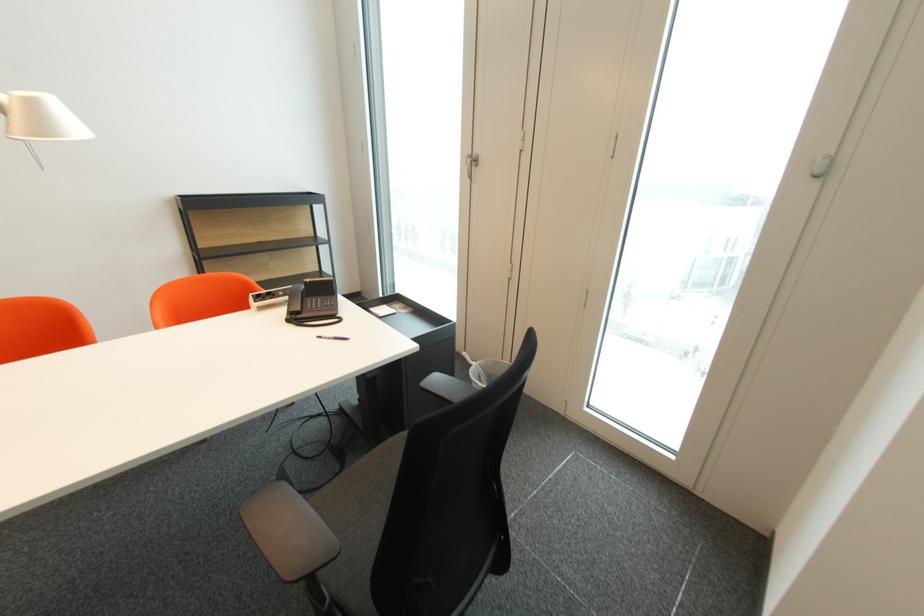
The image size is (924, 616). What do you see at coordinates (470, 163) in the screenshot?
I see `the metal door handle` at bounding box center [470, 163].